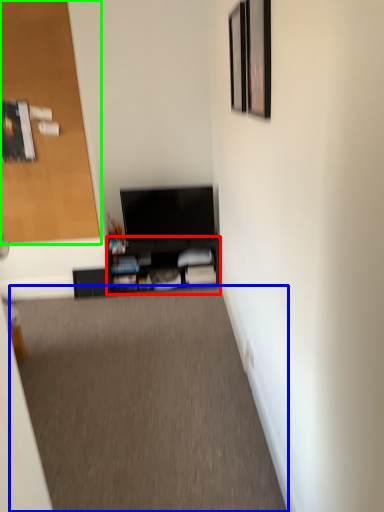
Question: Which object is positioned closest to shelf (highlighted by a red box)? Select from plain (highlighted by a blue box) and door (highlighted by a green box).

Choices:
 (A) plain
 (B) door

Answer: (B)